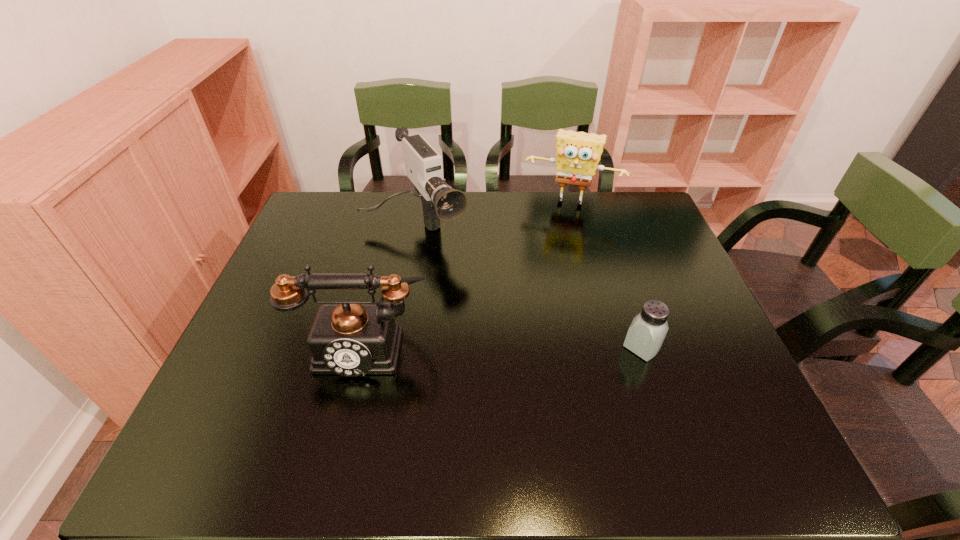
Find the location of `blank space at the right edge of the desktop`. blank space at the right edge of the desktop is located at coordinates (666, 243).

The width and height of the screenshot is (960, 540). Identify the location of vacant region at the far left corner of the desktop. pyautogui.click(x=329, y=209).

The image size is (960, 540). In the image, there is a desktop. What are the coordinates of `vacant space at the near left corner` in the screenshot? It's located at (235, 386).

The width and height of the screenshot is (960, 540). In the image, there is a desktop. Identify the location of free space at the far right corner. (634, 230).

The height and width of the screenshot is (540, 960). Find the location of `free space between the camcorder and the saltshaker`. free space between the camcorder and the saltshaker is located at coordinates (528, 288).

Where is `vacant space that is in between the saltshaker and the telephone`? vacant space that is in between the saltshaker and the telephone is located at coordinates (503, 346).

Image resolution: width=960 pixels, height=540 pixels. I want to click on free space between the saltshaker and the camcorder, so click(x=528, y=288).

Where is `free space between the telephone and the shortest object`? free space between the telephone and the shortest object is located at coordinates (503, 346).

This screenshot has height=540, width=960. Find the location of `free spot between the saltshaker and the sponge`. free spot between the saltshaker and the sponge is located at coordinates (607, 274).

Image resolution: width=960 pixels, height=540 pixels. I want to click on vacant space that's between the saltshaker and the sponge, so click(x=607, y=274).